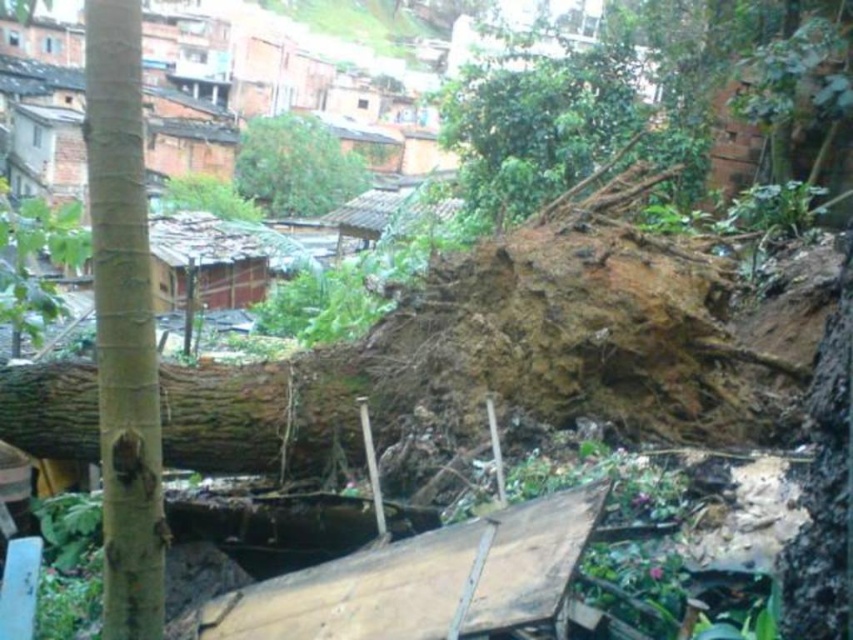
Question: Can you confirm if smooth brown tree trunk at left is positioned below green leafy tree at upper center?

Choices:
 (A) yes
 (B) no

Answer: (A)

Question: Which point is farther to the camera?

Choices:
 (A) rusty corrugated metal hut at center
 (B) smooth brown tree trunk at left
 (C) brown rough tree trunk at left

Answer: (A)

Question: Among these objects, which one is farthest from the camera?

Choices:
 (A) brown rough tree trunk at left
 (B) green leafy tree at upper center
 (C) smooth brown tree trunk at left

Answer: (B)

Question: Which of the following is the closest to the observer?

Choices:
 (A) green leafy tree at upper center
 (B) rusty corrugated metal hut at center-left
 (C) brown rough tree trunk at left
 (D) smooth brown tree trunk at left

Answer: (D)

Question: Is brown rough tree trunk at left closer to camera compared to rusty corrugated metal hut at center-left?

Choices:
 (A) no
 (B) yes

Answer: (B)

Question: Does green leafy tree at upper center come behind rusty corrugated metal hut at center?

Choices:
 (A) no
 (B) yes

Answer: (B)